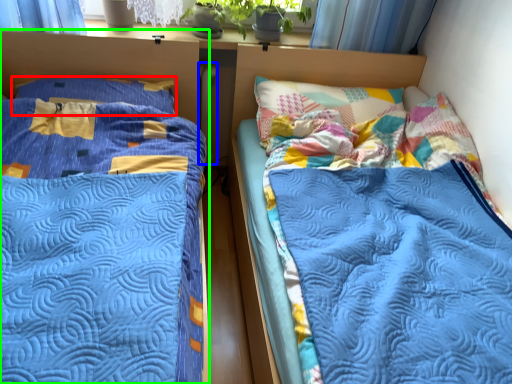
Question: Based on their relative distances, which object is nearer to pillow (highlighted by a red box)? Choose from radiator (highlighted by a blue box) and bed (highlighted by a green box).

Choices:
 (A) radiator
 (B) bed

Answer: (B)